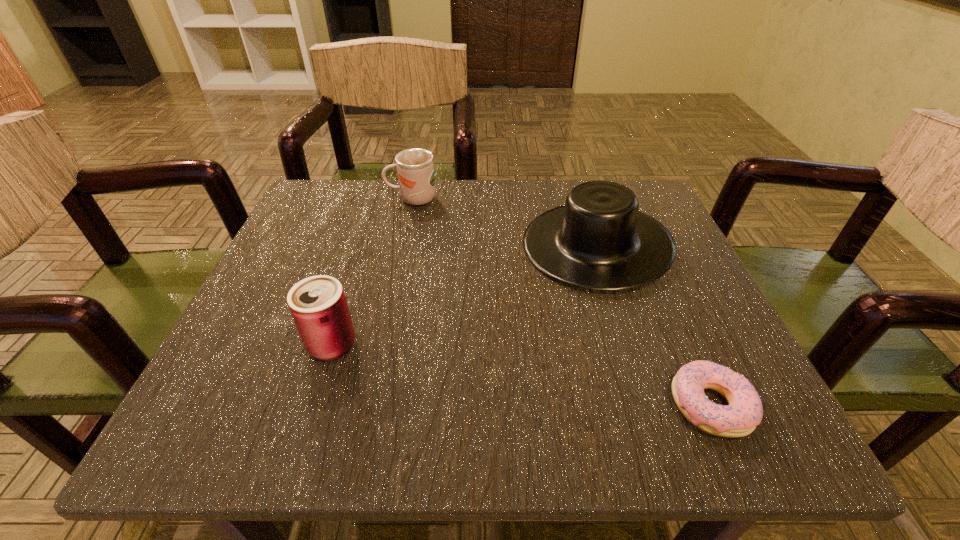
Find the location of `vacant area between the second nearest object and the nearest object`. vacant area between the second nearest object and the nearest object is located at coordinates (521, 375).

Image resolution: width=960 pixels, height=540 pixels. What are the coordinates of `unoccupied position between the nearest object and the can` in the screenshot? It's located at (521, 375).

Identify the location of empty space between the dress hat and the shortest object. (654, 325).

You are a GUI agent. You are given a task and a screenshot of the screen. Output one action in this format:
    pyautogui.click(x=<x>, y=<y>)
    Task: Click on the free space between the cup and the shortest object
    
    Given the screenshot: What is the action you would take?
    pyautogui.click(x=562, y=302)

Point out which object is positioned as the nearest to the doughnut. Please provide its 2D coordinates. Your answer should be formatted as a tuple, i.e. [(x, y)], where the tuple contains the x and y coordinates of a point satisfying the conditions above.

[(599, 240)]

The image size is (960, 540). In order to click on object identified as the second closest to the cup in this screenshot , I will do `click(318, 305)`.

Find the location of a particular element. The height and width of the screenshot is (540, 960). free spot that satisfies the following two spatial constraints: 1. on the back side of the can; 2. on the right side of the dress hat is located at coordinates (364, 245).

Find the location of a particular element. vacant region that satisfies the following two spatial constraints: 1. on the side with the handle of the cup; 2. on the back side of the doughnut is located at coordinates (370, 405).

At what (x,y) coordinates should I click in order to perform the action: click on free space that satisfies the following two spatial constraints: 1. on the side with the handle of the cup; 2. on the back side of the doughnut. Please return your answer as a coordinate pair (x, y). This screenshot has width=960, height=540. Looking at the image, I should click on (370, 405).

Find the location of a particular element. The image size is (960, 540). free space that satisfies the following two spatial constraints: 1. on the side with the handle of the dress hat; 2. on the right side of the cup is located at coordinates (403, 245).